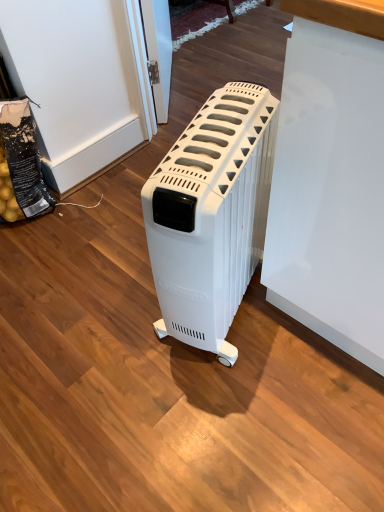
You are a GUI agent. You are given a task and a screenshot of the screen. Output one action in this format:
    pyautogui.click(x=<x>, y=<y>)
    Task: Click on the free location in front of white plastic heater at center
    This screenshot has width=384, height=512.
    Given the screenshot: What is the action you would take?
    pyautogui.click(x=228, y=406)